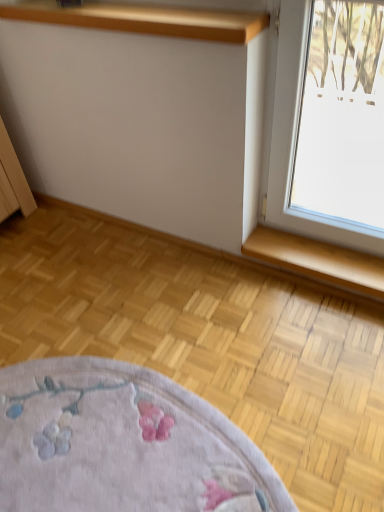
Question: Is wooden at lower right further to camera compared to wooden shelf at upper center?

Choices:
 (A) yes
 (B) no

Answer: (A)

Question: Does wooden at lower right turn towards wooden shelf at upper center?

Choices:
 (A) no
 (B) yes

Answer: (A)

Question: Is wooden at lower right facing away from wooden shelf at upper center?

Choices:
 (A) no
 (B) yes

Answer: (A)

Question: From a real-world perspective, is wooden at lower right on top of wooden shelf at upper center?

Choices:
 (A) yes
 (B) no

Answer: (B)

Question: Would you say wooden at lower right is a long distance from wooden shelf at upper center?

Choices:
 (A) no
 (B) yes

Answer: (A)

Question: Is wooden at lower right outside wooden shelf at upper center?

Choices:
 (A) no
 (B) yes

Answer: (B)

Question: Is wooden at lower right located within wooden shelf at upper center?

Choices:
 (A) no
 (B) yes

Answer: (A)

Question: Is wooden shelf at upper center at the left side of wooden at lower right?

Choices:
 (A) yes
 (B) no

Answer: (A)

Question: Is wooden shelf at upper center further to camera compared to wooden at lower right?

Choices:
 (A) no
 (B) yes

Answer: (A)

Question: From the image's perspective, is wooden shelf at upper center beneath wooden at lower right?

Choices:
 (A) no
 (B) yes

Answer: (A)

Question: Would you say wooden shelf at upper center is a long distance from wooden at lower right?

Choices:
 (A) no
 (B) yes

Answer: (A)

Question: From a real-world perspective, is wooden shelf at upper center beneath wooden at lower right?

Choices:
 (A) no
 (B) yes

Answer: (A)

Question: Does point (251, 35) appear closer or farther from the camera than point (312, 271)?

Choices:
 (A) farther
 (B) closer

Answer: (B)